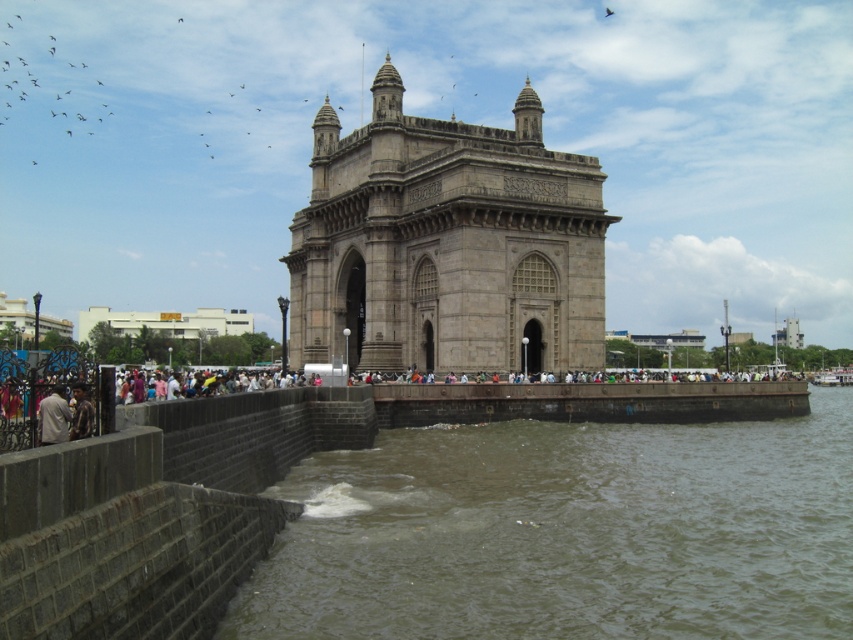
You are a tourist standing near the Gateway of India monument. You see the brown concrete river at lower center and the light brown fabric jacket at lower left. Which object is closer to you?

The brown concrete river at lower center is closer to you because it is in front of the light brown fabric jacket at lower left.

You are a photographer planning to capture a wide shot of the Gateway of India. You need to include both the brown concrete river at lower center and the light brown fabric jacket at lower left in your frame. Based on their sizes, which object should you focus on to ensure both are clearly visible in the photo?

The brown concrete river at lower center is wider than the light brown fabric jacket at lower left, so focusing on the brown concrete river at lower center will help ensure both objects are clearly visible in the photo.

You are standing at the point marked by the coordinates point (567, 532) in the image of the Gateway of India. What is the nearest object to you?

The nearest object to you at point (567, 532) is the brown concrete river at lower center, as the coordinates correspond directly to this location.